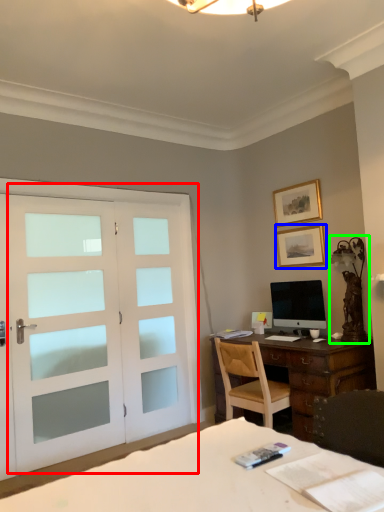
Question: Which is nearer to the door (highlighted by a red box)? picture frame (highlighted by a blue box) or table lamp (highlighted by a green box).

Choices:
 (A) picture frame
 (B) table lamp

Answer: (A)